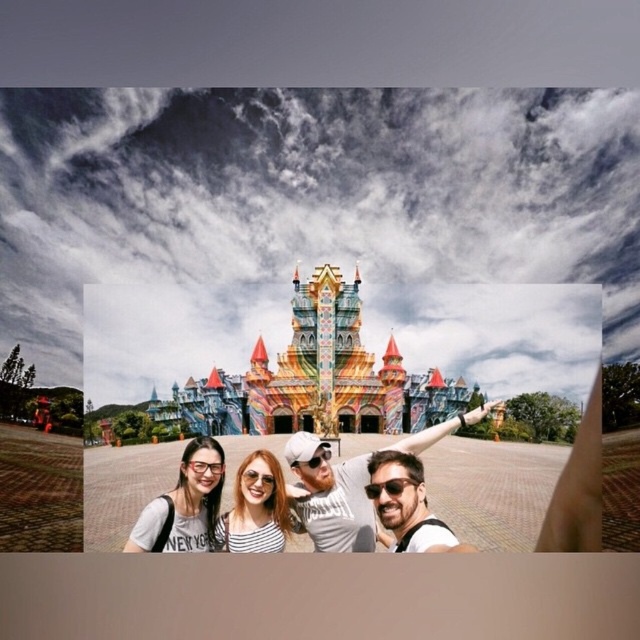
Question: Can you confirm if multicolored painted castle at center is thinner than sunglassesmaterial at center?

Choices:
 (A) yes
 (B) no

Answer: (B)

Question: Which object appears closest to the camera in this image?

Choices:
 (A) matte black glasses at center
 (B) matte white cap at center
 (C) sunglassesmaterial at center
 (D) matte striped shirt at center

Answer: (C)

Question: Can you confirm if matte white cap at center is positioned to the left of sunglassesmaterial at center?

Choices:
 (A) yes
 (B) no

Answer: (B)

Question: Which of the following is the farthest from the observer?

Choices:
 (A) matte black glasses at center
 (B) sunglassesmaterial at center
 (C) matte striped shirt at center

Answer: (A)

Question: Can you confirm if matte white cap at center is smaller than sunglassesmaterial at center?

Choices:
 (A) no
 (B) yes

Answer: (A)

Question: Which of the following is the closest to the observer?

Choices:
 (A) tap(392, 529)
 (B) tap(300, 435)
 (C) tap(224, 476)

Answer: (A)